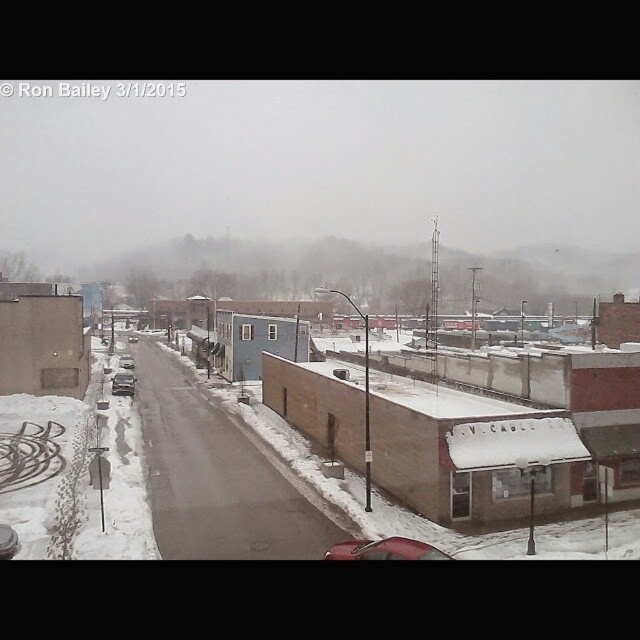
Question: Which of the following is the closest to the observer?

Choices:
 (A) (122, 381)
 (B) (353, 544)
 (C) (481, 486)
 (D) (132, 337)

Answer: (B)

Question: Can you confirm if metallic silver sedan at center-left is bigger than shiny silver sedan at center?

Choices:
 (A) yes
 (B) no

Answer: (B)

Question: Which object is farther from the camera taking this photo?

Choices:
 (A) metallic silver sedan at center-left
 (B) brown matte building at center
 (C) metallic silver sedan at center
 (D) shiny silver sedan at center

Answer: (D)

Question: Can you confirm if brown matte building at center is smaller than metallic silver sedan at center-left?

Choices:
 (A) no
 (B) yes

Answer: (A)

Question: In this image, where is metallic silver sedan at center-left located relative to metallic silver sedan at center?

Choices:
 (A) right
 (B) left

Answer: (A)

Question: Among these objects, which one is farthest from the camera?

Choices:
 (A) metallic silver sedan at center-left
 (B) brown matte building at center

Answer: (A)